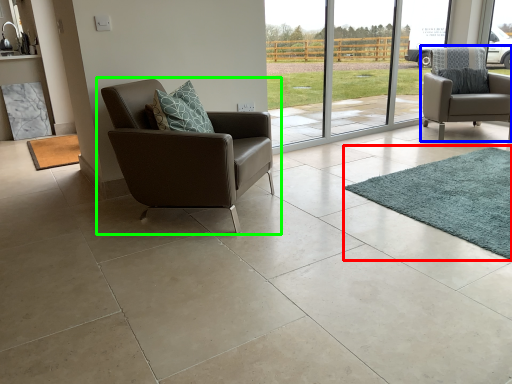
Question: Which is farther away from mat (highlighted by a red box)? chair (highlighted by a blue box) or chair (highlighted by a green box)?

Choices:
 (A) chair
 (B) chair

Answer: (A)